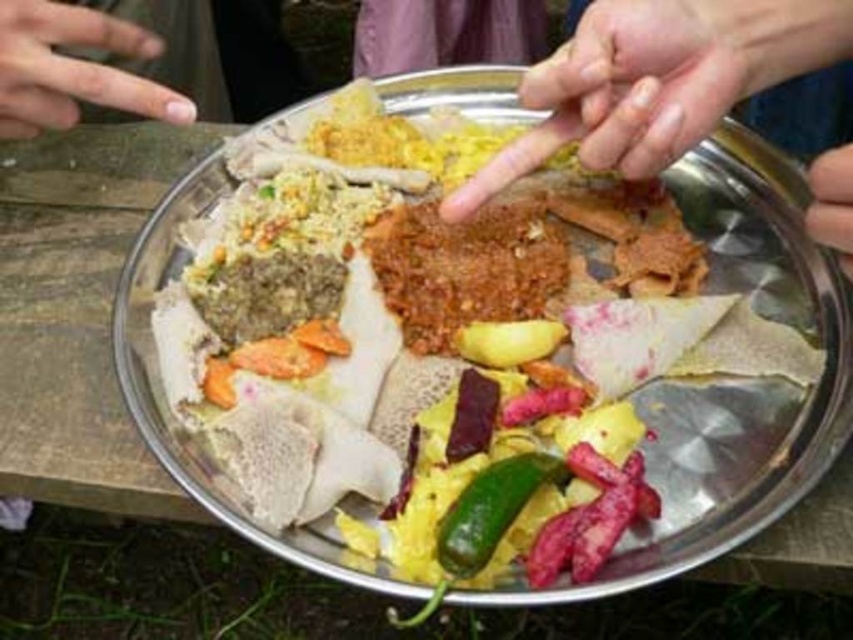
Which is more to the right, smooth skin hand at upper right or green matte pepper at center?

Positioned to the right is smooth skin hand at upper right.

Where is `smooth skin hand at upper right`? Image resolution: width=853 pixels, height=640 pixels. smooth skin hand at upper right is located at coordinates tap(627, 90).

Does point (329, 483) lie behind point (822, 186)?

Yes, point (329, 483) is farther from viewer.

Who is shorter, shiny metallic plate at center or smooth skin at center?

smooth skin at center

Measure the distance between point (430, 433) and camera.

20.37 inches

Where is `shiny metallic plate at center`? This screenshot has width=853, height=640. shiny metallic plate at center is located at coordinates point(416,368).

Who is more distant from viewer, (114, 106) or (840, 244)?

Positioned behind is point (114, 106).

Is point (100, 84) positioned behind point (838, 188)?

That is True.

Identify the location of nail polish at upper left. The width and height of the screenshot is (853, 640). click(x=73, y=68).